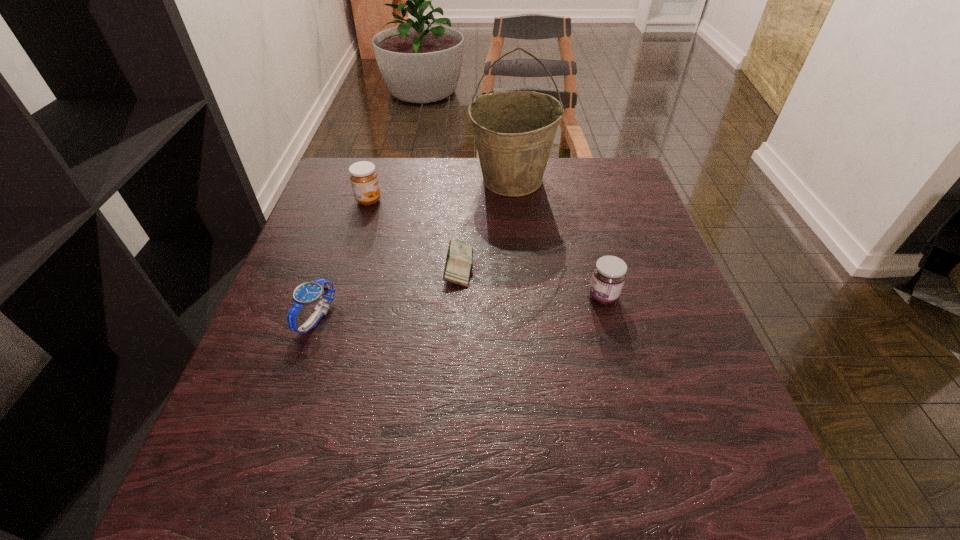
Identify the location of vacant space at the left edge. (313, 228).

In order to click on free space at the right edge in this screenshot , I will do `click(600, 240)`.

I want to click on free location at the near left corner of the desktop, so click(207, 491).

At what (x,y) coordinates should I click in order to perform the action: click on free region at the far right corner of the desktop. Please return your answer as a coordinate pair (x, y). Looking at the image, I should click on (605, 197).

Find the location of `vacant space that is in between the left jam and the rightmost object`. vacant space that is in between the left jam and the rightmost object is located at coordinates (486, 248).

Find the location of `free spot between the wine bucket and the shortest object`. free spot between the wine bucket and the shortest object is located at coordinates (485, 223).

The height and width of the screenshot is (540, 960). Find the location of `free space that is in between the shortest object and the watch`. free space that is in between the shortest object and the watch is located at coordinates (388, 292).

Where is `free spot between the watch and the rightmost object`? Image resolution: width=960 pixels, height=540 pixels. free spot between the watch and the rightmost object is located at coordinates (460, 307).

Locate an element on the screen. The height and width of the screenshot is (540, 960). vacant area that lies between the left jam and the rightmost object is located at coordinates (486, 248).

The width and height of the screenshot is (960, 540). I want to click on free space between the watch and the tallest object, so click(x=415, y=249).